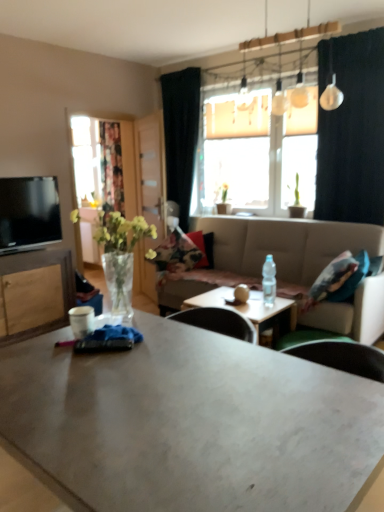
Question: Which direction should I rotate to look at matte white coffee table at center, the 1th coffee table from the back?

Choices:
 (A) right
 (B) left

Answer: (A)

Question: Which direction should I rotate to face matte gray coffee table at center, which appears as the second coffee table when viewed from the back, — up or down?

Choices:
 (A) up
 (B) down

Answer: (B)

Question: Could you tell me if beige fabric couch at center is facing matte white coffee table at center, which appears as the second coffee table when viewed from the front?

Choices:
 (A) yes
 (B) no

Answer: (A)

Question: Is beige fabric couch at center looking in the opposite direction of matte white coffee table at center, which appears as the second coffee table when viewed from the front?

Choices:
 (A) no
 (B) yes

Answer: (A)

Question: Is beige fabric couch at center not inside matte white coffee table at center, the 1th coffee table from the back?

Choices:
 (A) yes
 (B) no

Answer: (A)

Question: Is beige fabric couch at center shorter than matte white coffee table at center, which appears as the second coffee table when viewed from the front?

Choices:
 (A) no
 (B) yes

Answer: (A)

Question: Is beige fabric couch at center far from matte white coffee table at center, which appears as the second coffee table when viewed from the front?

Choices:
 (A) yes
 (B) no

Answer: (B)

Question: Is beige fabric couch at center surrounding matte white coffee table at center, which appears as the second coffee table when viewed from the front?

Choices:
 (A) yes
 (B) no

Answer: (B)

Question: Does clear glass vase at left have a lesser height compared to wooden cabinet at left?

Choices:
 (A) yes
 (B) no

Answer: (A)

Question: From the image's perspective, is clear glass vase at left over wooden cabinet at left?

Choices:
 (A) no
 (B) yes

Answer: (B)

Question: Is clear glass vase at left closer to the viewer compared to wooden cabinet at left?

Choices:
 (A) yes
 (B) no

Answer: (A)

Question: From a real-world perspective, is clear glass vase at left positioned under wooden cabinet at left based on gravity?

Choices:
 (A) yes
 (B) no

Answer: (B)

Question: Is clear glass vase at left not near wooden cabinet at left?

Choices:
 (A) yes
 (B) no

Answer: (A)

Question: Would you say clear glass vase at left is outside wooden cabinet at left?

Choices:
 (A) no
 (B) yes

Answer: (B)

Question: Does floral-patterned fabric pillow at center have a lesser width compared to matte gray coffee table at center, which appears as the second coffee table when viewed from the back?

Choices:
 (A) yes
 (B) no

Answer: (A)